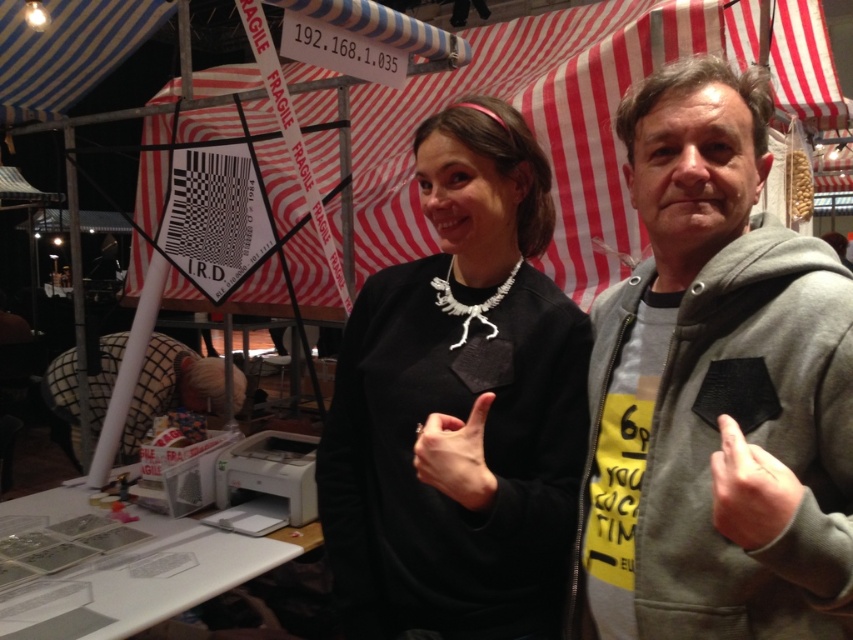
Question: Based on their relative distances, which object is farther from the matte black hand at center?

Choices:
 (A) gray fabric hand at center
 (B) gray hoodie at right
 (C) black matte sweatshirt at center

Answer: (A)

Question: Is gray hoodie at right closer to camera compared to plaid fabric man at lower left?

Choices:
 (A) no
 (B) yes

Answer: (B)

Question: Which object is positioned farthest from the black matte sweatshirt at center?

Choices:
 (A) gray fabric hand at center
 (B) plaid fabric man at lower left
 (C) gray hoodie at right
 (D) matte black hand at center

Answer: (B)

Question: Does black matte sweatshirt at center have a larger size compared to gray fabric hand at center?

Choices:
 (A) no
 (B) yes

Answer: (B)

Question: Which point appears closest to the camera in this image?

Choices:
 (A) (457, 481)
 (B) (184, 358)

Answer: (A)

Question: Is black matte sweatshirt at center positioned before gray fabric hand at center?

Choices:
 (A) no
 (B) yes

Answer: (A)